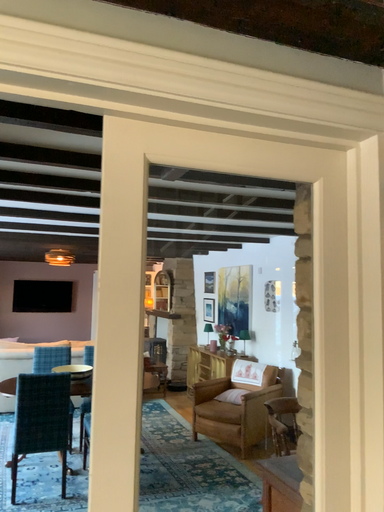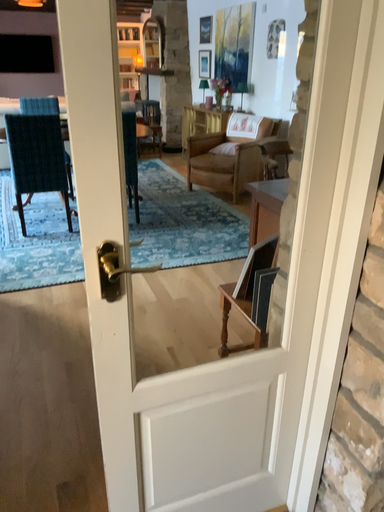
Question: How did the camera likely rotate when shooting the video?

Choices:
 (A) rotated downward
 (B) rotated upward

Answer: (A)